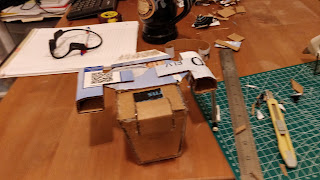
Where is `wooden table`? The width and height of the screenshot is (320, 180). wooden table is located at coordinates (49, 127).